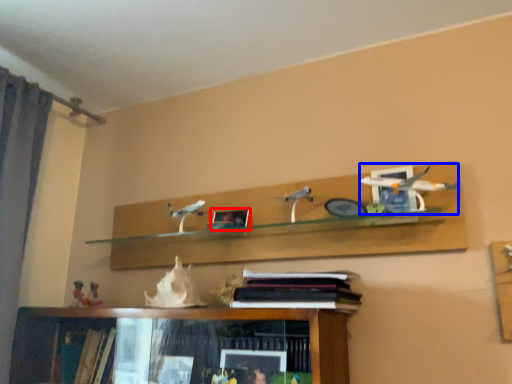
Question: Which point is closer to the camera, picture frame (highlighted by a red box) or toy (highlighted by a blue box)?

Choices:
 (A) picture frame
 (B) toy

Answer: (B)